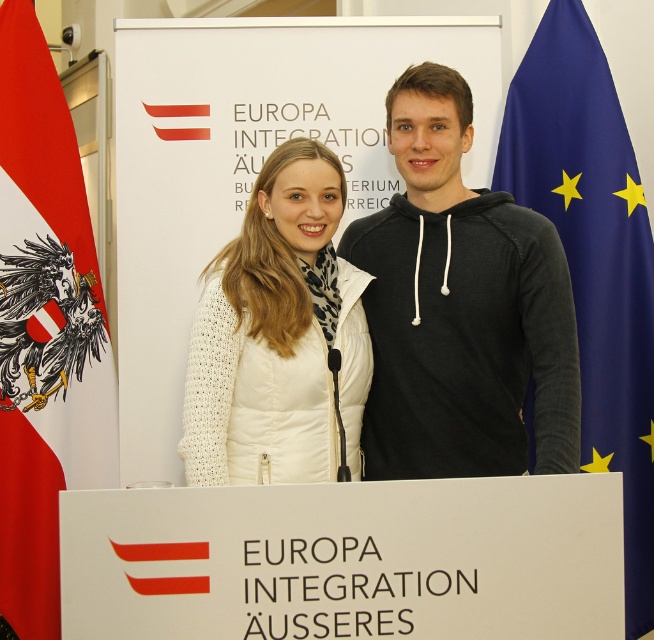
Question: Which object is positioned closest to the red fabric flag at left?

Choices:
 (A) blue fabric flag at right
 (B) black hoodie at center

Answer: (B)

Question: Can you confirm if black hoodie at center is bigger than white knitted jacket at center?

Choices:
 (A) no
 (B) yes

Answer: (B)

Question: Which object is closer to the camera taking this photo?

Choices:
 (A) white knitted jacket at center
 (B) red fabric flag at left
 (C) blue fabric flag at right

Answer: (A)

Question: Which of the following is the closest to the observer?

Choices:
 (A) white knitted jacket at center
 (B) black hoodie at center
 (C) red fabric flag at left
 (D) blue fabric flag at right

Answer: (A)

Question: Can you confirm if black hoodie at center is positioned below blue fabric flag at right?

Choices:
 (A) no
 (B) yes

Answer: (A)

Question: Is black hoodie at center to the right of blue fabric flag at right from the viewer's perspective?

Choices:
 (A) yes
 (B) no

Answer: (B)